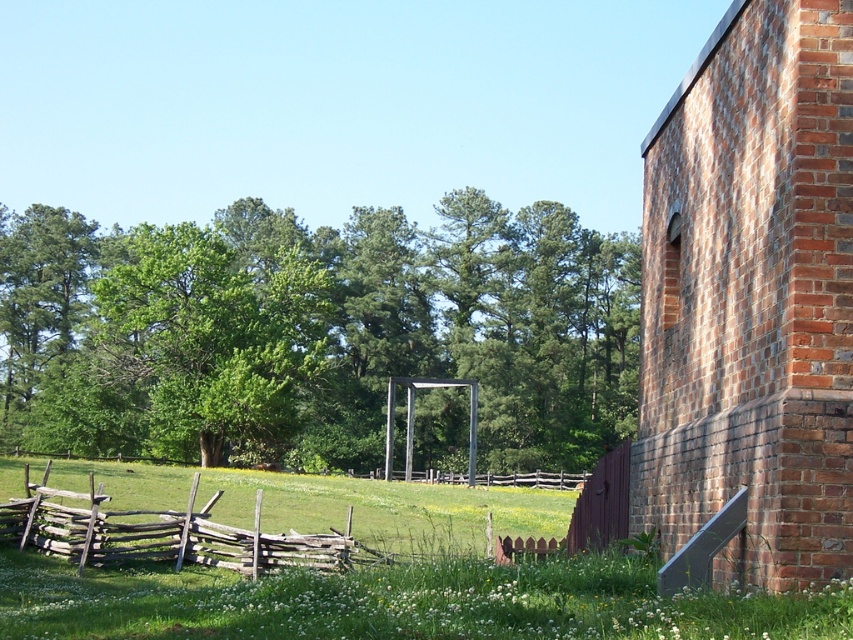
Question: Which is nearer to the weathered wood fence at lower left?

Choices:
 (A) green leafy tree at center
 (B) brown wooden fence at center
 (C) brown wooden fence at lower right

Answer: (C)

Question: Which object is closer to the camera taking this photo?

Choices:
 (A) weathered wood fence at lower left
 (B) brick chimney at right
 (C) brown wooden fence at center

Answer: (B)

Question: Is green leafy tree at center in front of weathered wood fence at lower left?

Choices:
 (A) no
 (B) yes

Answer: (A)

Question: Is green leafy tree at center to the right of brown wooden fence at lower right from the viewer's perspective?

Choices:
 (A) no
 (B) yes

Answer: (A)

Question: Does brick chimney at right have a smaller size compared to brown wooden fence at center?

Choices:
 (A) yes
 (B) no

Answer: (A)

Question: Which is farther from the brown wooden fence at lower right?

Choices:
 (A) brown wooden fence at center
 (B) weathered wood fence at lower left
 (C) green leafy tree at center

Answer: (C)